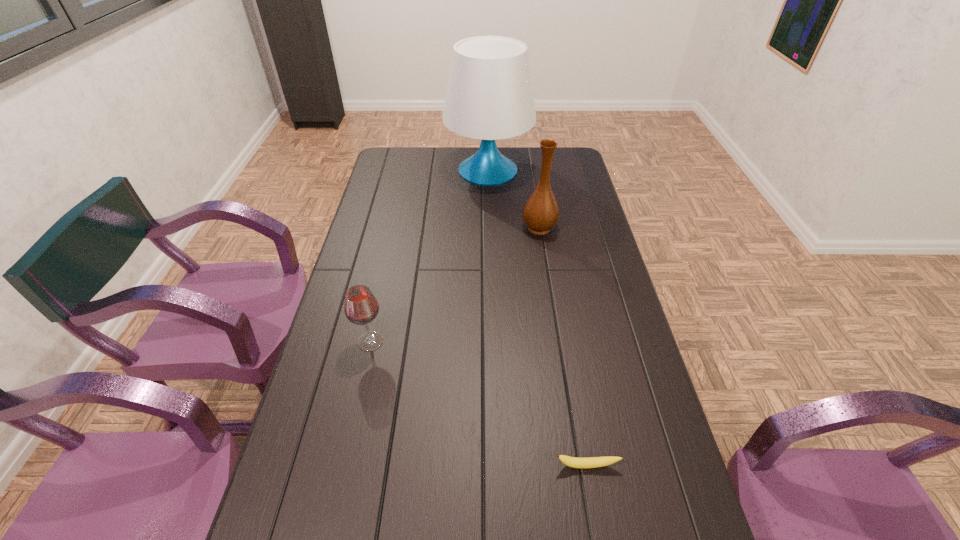
You are a GUI agent. You are given a task and a screenshot of the screen. Output one action in this format:
    pyautogui.click(x=<x>, y=<y>)
    Task: Click on the free space between the second nearest object and the nearest object
    Image resolution: width=960 pixels, height=540 pixels.
    Given the screenshot: What is the action you would take?
    pyautogui.click(x=479, y=403)

Locate which object ranks third in proximity to the tallest object. Please provide its 2D coordinates. Your answer should be formatted as a tuple, i.e. [(x, y)], where the tuple contains the x and y coordinates of a point satisfying the conditions above.

[(592, 462)]

Locate which object is the second closest to the farthest object. Please provide its 2D coordinates. Your answer should be formatted as a tuple, i.e. [(x, y)], where the tuple contains the x and y coordinates of a point satisfying the conditions above.

[(361, 307)]

I want to click on vacant region that satisfies the following two spatial constraints: 1. on the back side of the leftmost object; 2. on the left side of the third shortest object, so click(396, 227).

This screenshot has width=960, height=540. What are the coordinates of `vacant area that satisfies the following two spatial constraints: 1. on the back side of the second tallest object; 2. on the right side of the third farthest object` in the screenshot? It's located at (396, 227).

At what (x,y) coordinates should I click in order to perform the action: click on free space that satisfies the following two spatial constraints: 1. on the front-facing side of the vase; 2. on the left side of the table lamp. Please return your answer as a coordinate pair (x, y). Looking at the image, I should click on (490, 227).

Where is `free space that satisfies the following two spatial constraints: 1. on the front-facing side of the vase; 2. on the right side of the tallest object`? This screenshot has height=540, width=960. free space that satisfies the following two spatial constraints: 1. on the front-facing side of the vase; 2. on the right side of the tallest object is located at coordinates (490, 227).